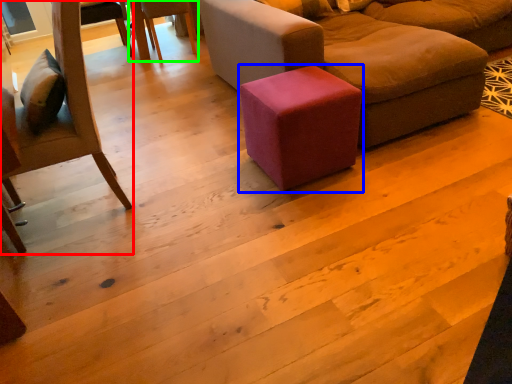
Question: Based on their relative distances, which object is nearer to chair (highlighted by a red box)? Choose from stool (highlighted by a blue box) and chair (highlighted by a green box).

Choices:
 (A) stool
 (B) chair

Answer: (A)